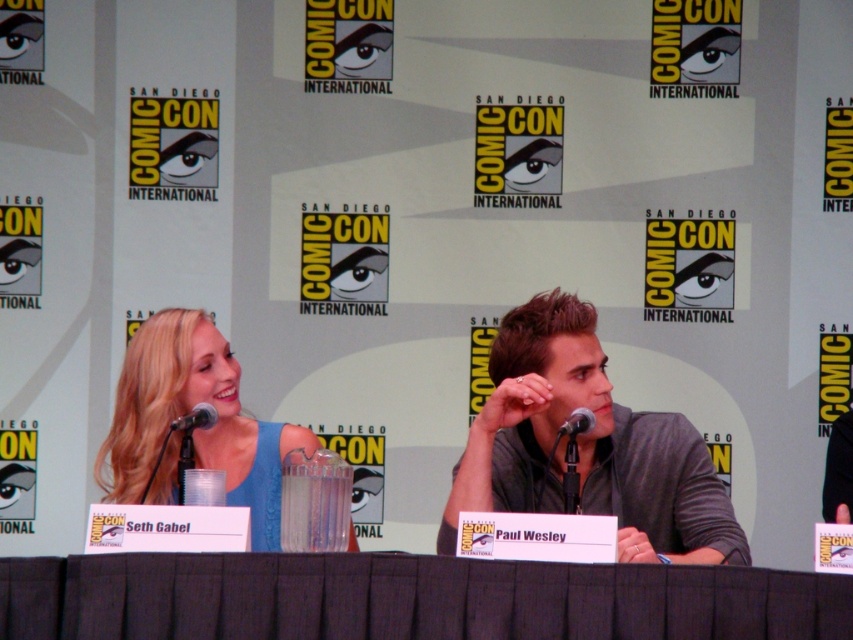
You are a photographer at Comic Con and you need to capture a close up shot of the black metallic microphone at left and the black metallic microphone at center. Which microphone should you choose to ensure it appears larger in the photo?

The black metallic microphone at left is larger in size compared to the black metallic microphone at center, so it will appear larger in the photo.

You are standing in the audience at Comic Con and want to take a photo of the point at coordinates (x=209, y=420). The camera you have can focus on objects up to 3 meters away. Will your camera be able to focus on the point?

The point at coordinates (x=209, y=420) is 3.24 meters away from the camera, which is beyond the camera maximum focus range of 3 meters. Therefore, the camera will not be able to focus on the point.